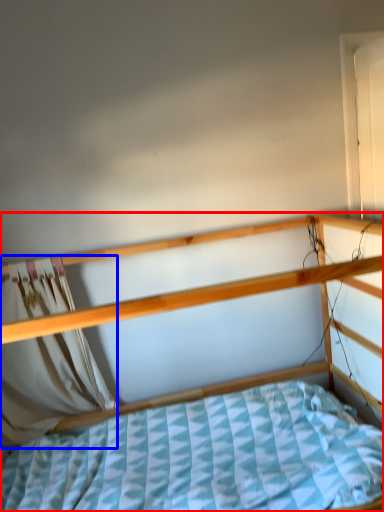
Question: Among these objects, which one is farthest to the camera, bed (highlighted by a red box) or curtain (highlighted by a blue box)?

Choices:
 (A) bed
 (B) curtain

Answer: (B)